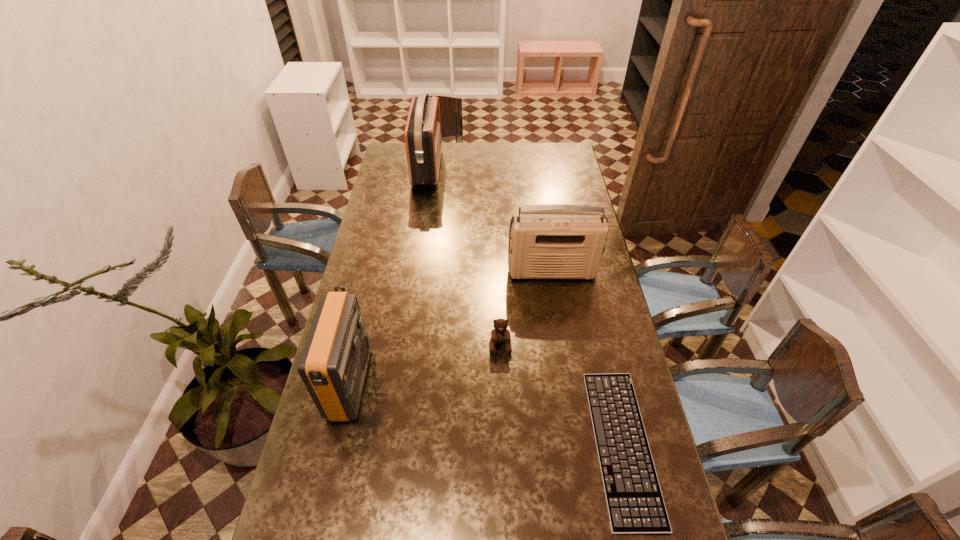
Find the location of a particular element. The image size is (960, 540). free region at the right edge of the desktop is located at coordinates (560, 177).

Locate an element on the screen. This screenshot has height=540, width=960. vacant area between the teddy bear and the second farthest radio receiver is located at coordinates point(526,309).

This screenshot has width=960, height=540. Identify the location of free space between the leftmost radio receiver and the farthest radio receiver. (389, 275).

At what (x,y) coordinates should I click in order to perform the action: click on unoccupied position between the shortest object and the second radio receiver from left to right. Please return your answer as a coordinate pair (x, y). This screenshot has height=540, width=960. Looking at the image, I should click on (524, 306).

Locate an element on the screen. free space between the second radio receiver from left to right and the computer keyboard is located at coordinates (524, 306).

I want to click on empty space between the leftmost radio receiver and the teddy bear, so click(425, 364).

Where is `free space between the rightmost radio receiver and the third object from left to right`? free space between the rightmost radio receiver and the third object from left to right is located at coordinates (526, 309).

Locate an element on the screen. free space between the rightmost radio receiver and the shortest object is located at coordinates (587, 359).

In order to click on vacant area that lies between the second radio receiver from right to left and the teddy bear in this screenshot , I will do `click(464, 256)`.

The width and height of the screenshot is (960, 540). In order to click on free space between the computer keyboard and the third object from left to right in this screenshot , I will do (x=561, y=395).